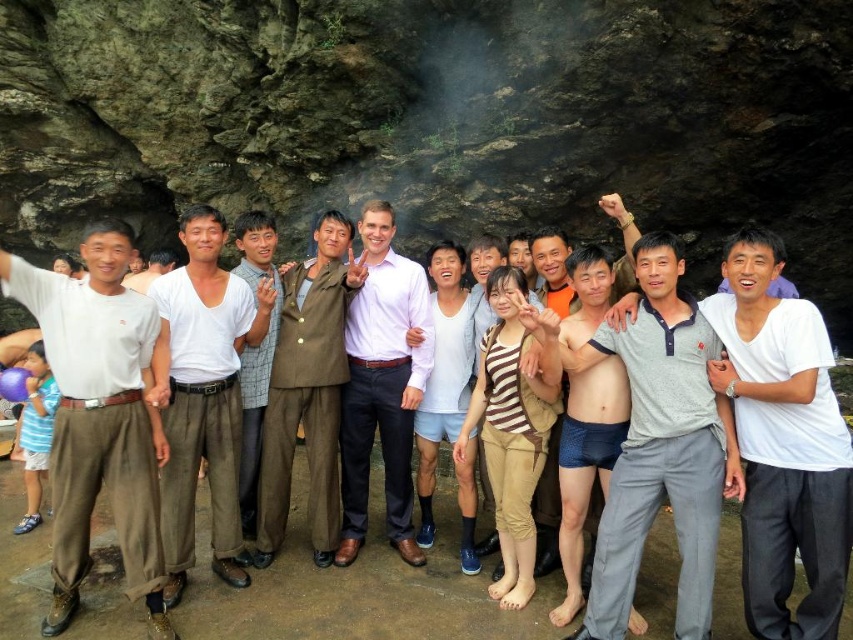
You are a photographer trying to capture a photo of the group in the cave. You notice the white cotton shirt at left and the green fabric pants at center. Which clothing item is closer to the bottom of the image?

The white cotton shirt at left is positioned under the green fabric pants at center, meaning it is closer to the bottom of the image.

You are a photographer trying to capture a group photo of the gray cotton pants at center and the light brown cotton shirt at center. You need to ensure both subjects are fully visible in the frame. Given their sizes, which subject might require you to adjust your camera angle to avoid cropping?

The light brown cotton shirt at center is wider than the gray cotton pants at center, so you might need to adjust the camera angle to ensure the light brown cotton shirt at center fits entirely within the frame.

You are a photographer trying to capture a group photo of the gray cotton polo shirt at center and the matte brown suit at center. Which clothing item should you focus on first if you want to start from the left side of the group?

The matte brown suit at center should be focused on first because the gray cotton polo shirt at center is positioned on the right side of it.